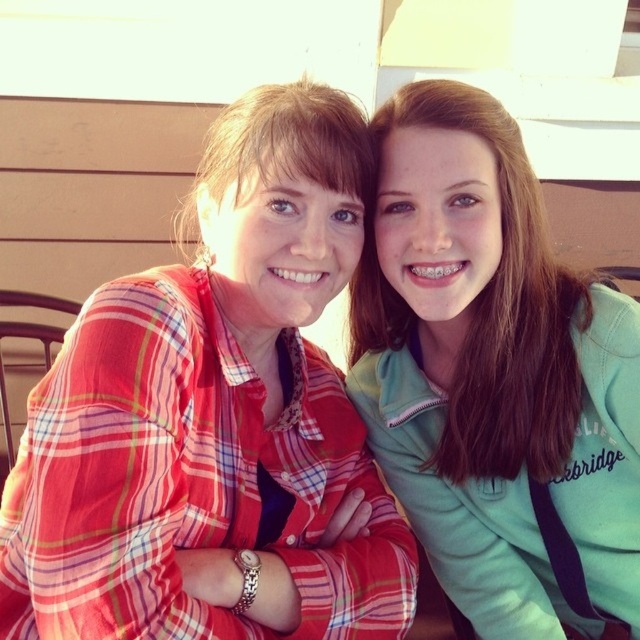
Between point (392, 538) and point (481, 124), which one is positioned behind?

The point (392, 538) is behind.

Between plaid shirt at center and teal fleece jacket at upper right, which one appears on the right side from the viewer's perspective?

From the viewer's perspective, teal fleece jacket at upper right appears more on the right side.

This screenshot has width=640, height=640. What do you see at coordinates (216, 419) in the screenshot?
I see `plaid shirt at center` at bounding box center [216, 419].

The width and height of the screenshot is (640, 640). What are the coordinates of `plaid shirt at center` in the screenshot? It's located at (216, 419).